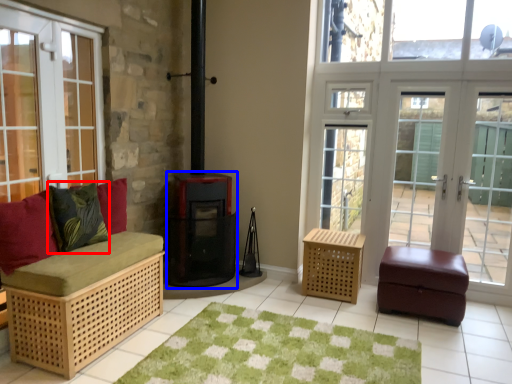
Question: Among these objects, which one is nearest to the camera, pillow (highlighted by a red box) or wood burning stove (highlighted by a blue box)?

Choices:
 (A) pillow
 (B) wood burning stove

Answer: (A)